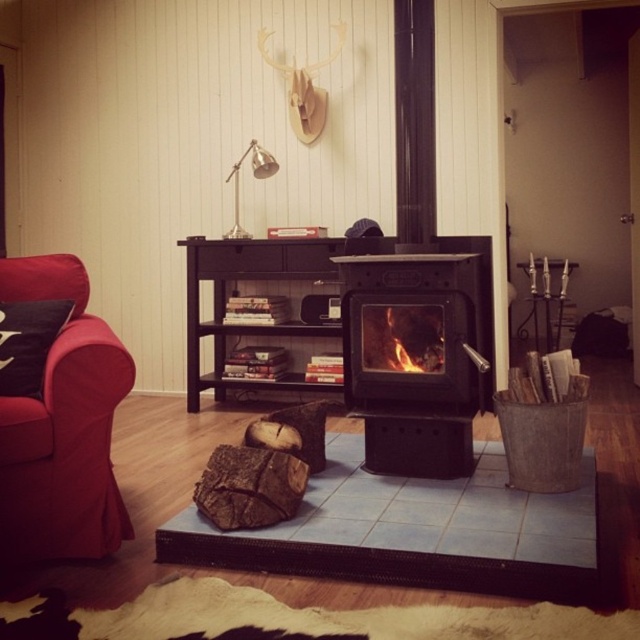
Question: Which object is the farthest from the flaming wood at center?

Choices:
 (A) matte red armchair at left
 (B) black cast iron fireplace at center
 (C) brown rough wood at center

Answer: (A)

Question: Can you confirm if matte red armchair at left is positioned to the left of brown rough wood at center?

Choices:
 (A) no
 (B) yes

Answer: (B)

Question: Is brown rough wood at center positioned in front of flaming wood at center?

Choices:
 (A) yes
 (B) no

Answer: (A)

Question: Does matte red armchair at left have a larger size compared to flaming wood at center?

Choices:
 (A) no
 (B) yes

Answer: (B)

Question: Which of the following is the closest to the observer?

Choices:
 (A) black cast iron fireplace at center
 (B) brown rough wood at center
 (C) matte red armchair at left
 (D) flaming wood at center

Answer: (C)

Question: Estimate the real-world distances between objects in this image. Which object is closer to the black cast iron fireplace at center?

Choices:
 (A) flaming wood at center
 (B) matte red armchair at left

Answer: (A)